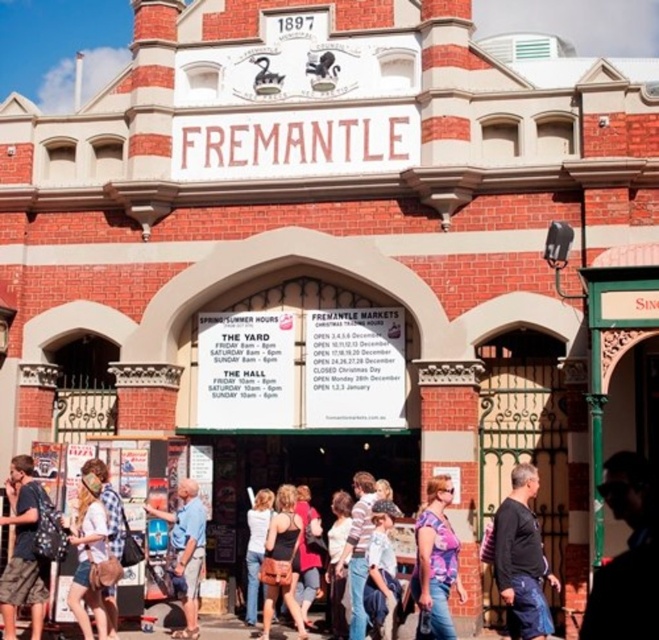
You are a photographer planning to take a picture of the Fremantle Markets entrance. You notice a person wearing a dark blue shirt at lower right and camouflage shorts at lower left. Based on their positions, which clothing item appears narrower in the photo?

The dark blue shirt at lower right appears narrower in the photo compared to the camouflage shorts at lower left because it has a lesser width according to the description.

You are shopping at the Fremantle Markets and see two items displayed at the entrance. The first is a matte black tank top at center and the second is a striped cotton shirt at center. Which item takes up more space in the display?

The striped cotton shirt at center takes up more space in the display because it is larger than the matte black tank top at center.

You are standing at the entrance of the Fremantle Markets and notice a black cotton shirt at right and a blue shirt at center. Which shirt is nearer to you?

The black cotton shirt at right is closer to the viewer than the blue shirt at center.